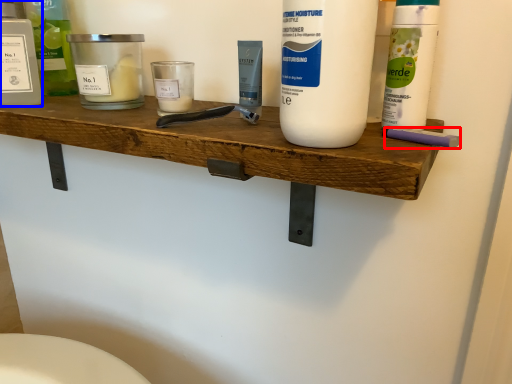
Question: Which object appears closest to the camera in this image, personal care (highlighted by a red box) or personal care (highlighted by a blue box)?

Choices:
 (A) personal care
 (B) personal care

Answer: (A)